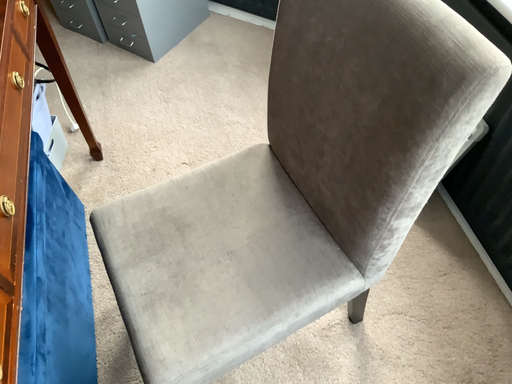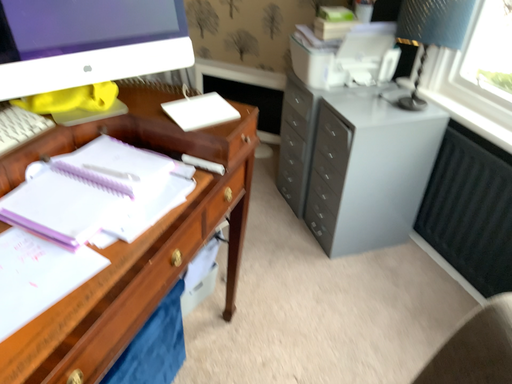
Question: How did the camera likely rotate when shooting the video?

Choices:
 (A) rotated downward
 (B) rotated upward

Answer: (B)